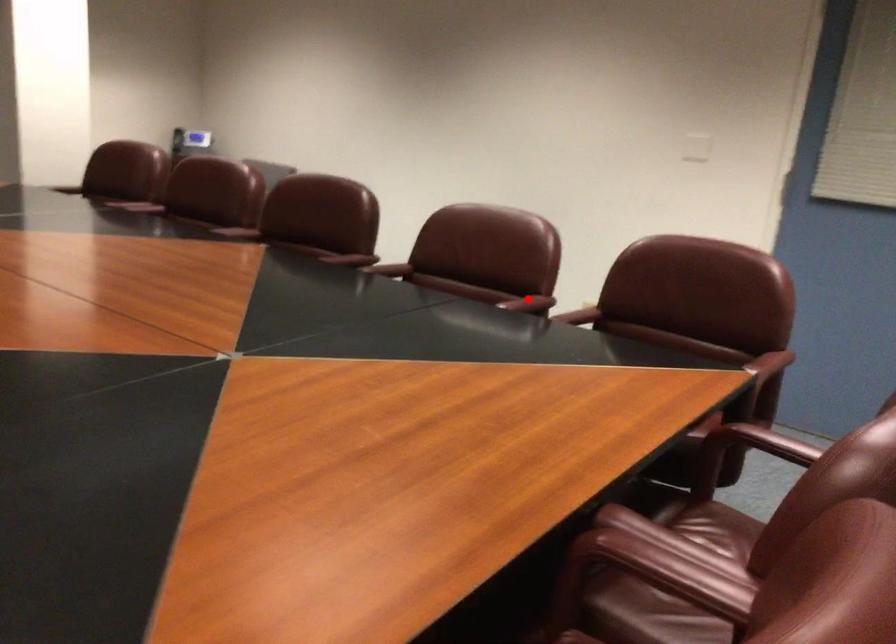
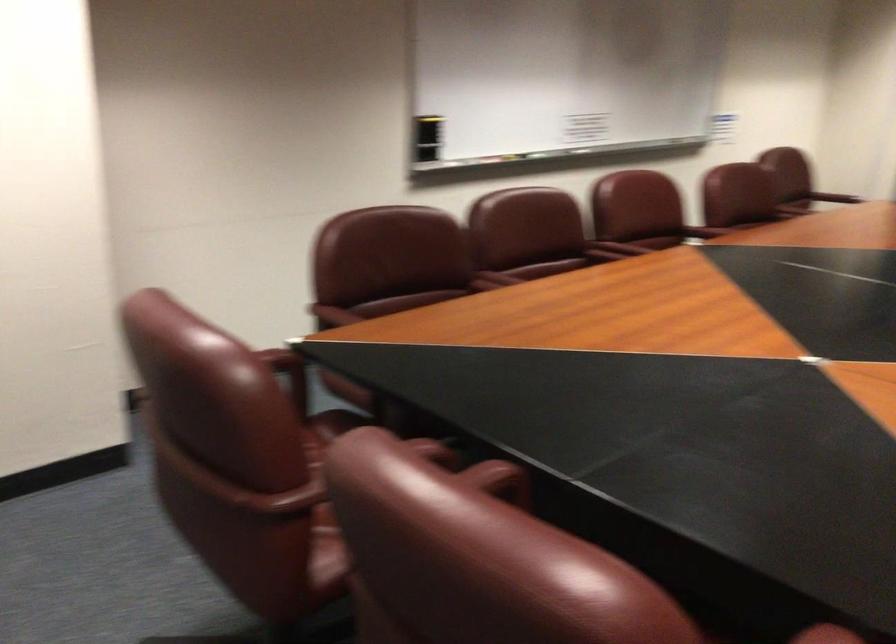
Where in the second image is the point corresponding to the highlighted location from the first image?

(495, 478)